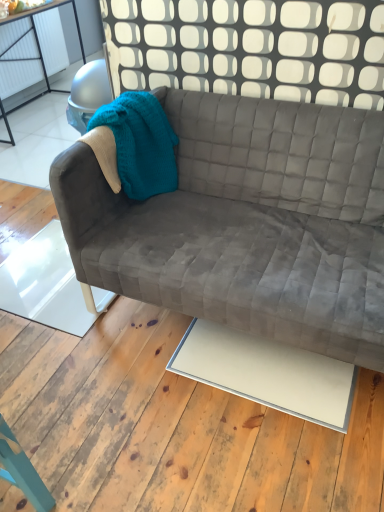
Question: From the image's perspective, is white matte plywood at center above velvet gray couch at center?

Choices:
 (A) yes
 (B) no

Answer: (B)

Question: Is white matte plywood at center looking in the opposite direction of velvet gray couch at center?

Choices:
 (A) no
 (B) yes

Answer: (A)

Question: Is white matte plywood at center bigger than velvet gray couch at center?

Choices:
 (A) no
 (B) yes

Answer: (A)

Question: Would you say white matte plywood at center is outside velvet gray couch at center?

Choices:
 (A) yes
 (B) no

Answer: (A)

Question: Does white matte plywood at center lie behind velvet gray couch at center?

Choices:
 (A) yes
 (B) no

Answer: (B)

Question: Is white matte plywood at center shorter than velvet gray couch at center?

Choices:
 (A) no
 (B) yes

Answer: (B)

Question: Can you confirm if velvet gray couch at center is bigger than white matte plywood at center?

Choices:
 (A) yes
 (B) no

Answer: (A)

Question: Is velvet gray couch at center closer to camera compared to white matte plywood at center?

Choices:
 (A) yes
 (B) no

Answer: (B)

Question: Is white matte plywood at center surrounded by velvet gray couch at center?

Choices:
 (A) yes
 (B) no

Answer: (B)

Question: Is velvet gray couch at center to the left of white matte plywood at center from the viewer's perspective?

Choices:
 (A) yes
 (B) no

Answer: (B)

Question: Is velvet gray couch at center outside of white matte plywood at center?

Choices:
 (A) no
 (B) yes

Answer: (B)

Question: Are velvet gray couch at center and white matte plywood at center beside each other?

Choices:
 (A) no
 (B) yes

Answer: (A)

Question: Based on their sizes in the image, would you say velvet gray couch at center is bigger or smaller than white matte plywood at center?

Choices:
 (A) big
 (B) small

Answer: (A)